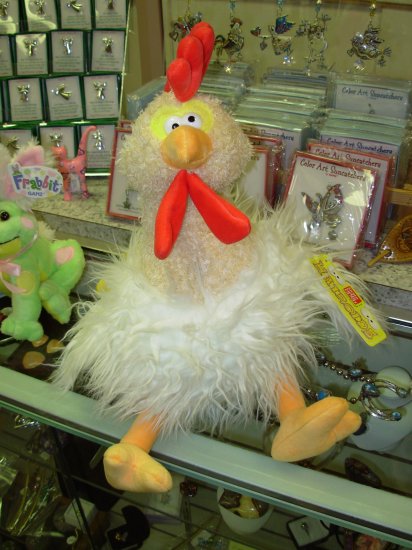
Identify the location of butterfly suncatcher. Image resolution: width=412 pixels, height=550 pixels. click(323, 206).